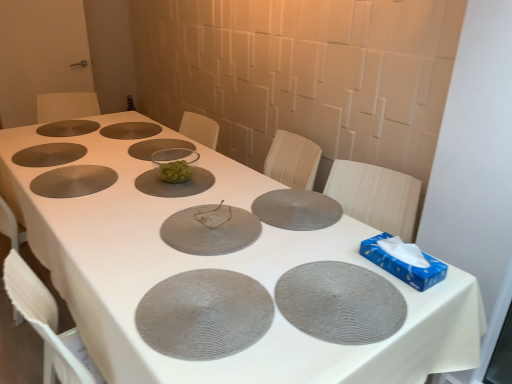
You are a GUI agent. You are given a task and a screenshot of the screen. Output one action in this format:
    pyautogui.click(x=<x>, y=<y>)
    Task: Click on the free space between matte gray placemat at left, which appears as the fifth glass plate when viewed from the front, and green glass bowl at center
    The image size is (512, 384).
    Given the screenshot: What is the action you would take?
    pyautogui.click(x=120, y=175)